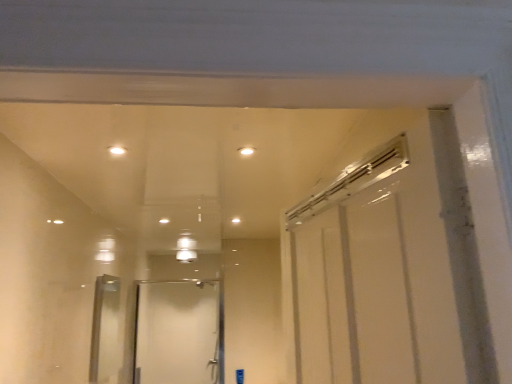
Question: Does clear glass door at center lie in front of white glossy light at upper center, arranged as the 2th light when viewed from the right?

Choices:
 (A) yes
 (B) no

Answer: (B)

Question: Are clear glass door at center and white glossy light at upper center, the 1th light in the left-to-right sequence, located far from each other?

Choices:
 (A) no
 (B) yes

Answer: (B)

Question: From a real-world perspective, is clear glass door at center positioned over white glossy light at upper center, arranged as the 2th light when viewed from the right, based on gravity?

Choices:
 (A) no
 (B) yes

Answer: (A)

Question: Is clear glass door at center outside of white glossy light at upper center, arranged as the 2th light when viewed from the right?

Choices:
 (A) no
 (B) yes

Answer: (B)

Question: Does clear glass door at center have a lesser width compared to white glossy light at upper center, arranged as the 2th light when viewed from the right?

Choices:
 (A) no
 (B) yes

Answer: (A)

Question: Considering the relative positions of white glossy light at upper center, arranged as the 2th light when viewed from the right, and clear glass door at center in the image provided, is white glossy light at upper center, arranged as the 2th light when viewed from the right, to the left or to the right of clear glass door at center?

Choices:
 (A) right
 (B) left

Answer: (A)

Question: In terms of height, does white glossy light at upper center, arranged as the 2th light when viewed from the right, look taller or shorter compared to clear glass door at center?

Choices:
 (A) short
 (B) tall

Answer: (A)

Question: Is white glossy light at upper center, arranged as the 2th light when viewed from the right, wider or thinner than clear glass door at center?

Choices:
 (A) wide
 (B) thin

Answer: (B)

Question: From a real-world perspective, is white glossy light at upper center, the 1th light in the left-to-right sequence, positioned above or below clear glass door at center?

Choices:
 (A) above
 (B) below

Answer: (A)

Question: Relative to white glossy light at upper center, arranged as the 2th light when viewed from the right, is clear glass door at center in front or behind?

Choices:
 (A) front
 (B) behind

Answer: (B)

Question: Considering the relative positions of clear glass door at center and white glossy light at upper center, arranged as the 2th light when viewed from the right, in the image provided, is clear glass door at center to the left or to the right of white glossy light at upper center, arranged as the 2th light when viewed from the right,?

Choices:
 (A) right
 (B) left

Answer: (B)

Question: Is point (206, 289) positioned closer to the camera than point (124, 150)?

Choices:
 (A) farther
 (B) closer

Answer: (A)

Question: Looking at their shapes, would you say clear glass door at center is wider or thinner than white glossy light at upper center, arranged as the 2th light when viewed from the right?

Choices:
 (A) wide
 (B) thin

Answer: (A)

Question: From the image's perspective, is white glossy light at upper center, arranged as the 2th light when viewed from the right, positioned above or below white glossy light at upper center, which is the second light in left-to-right order?

Choices:
 (A) below
 (B) above

Answer: (A)

Question: Visually, is white glossy light at upper center, arranged as the 2th light when viewed from the right, positioned to the left or to the right of white glossy light at upper center, which is the 1th light from right to left?

Choices:
 (A) right
 (B) left

Answer: (B)